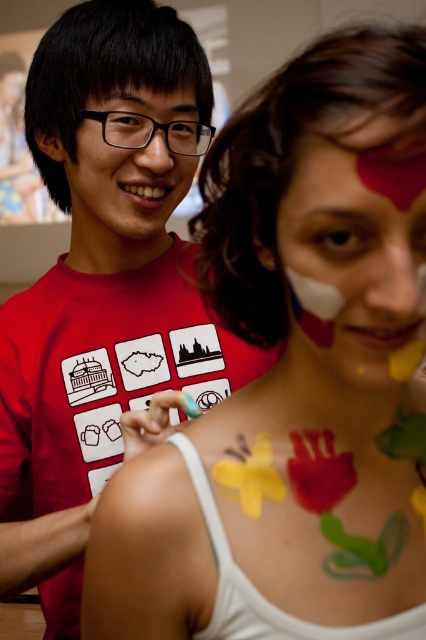
You are standing at the camera position and want to reach the point marked at coordinates point (184, 308). If you take a step forward of 30 inches, will you still be 2 feet away from the point?

The point marked at coordinates point (184, 308) is 32.27 inches away from the camera. If you take a step forward of 30 inches, you will be 2.27 inches away from the point, which is less than 2 feet. Therefore, you will not be 2 feet away from the point.